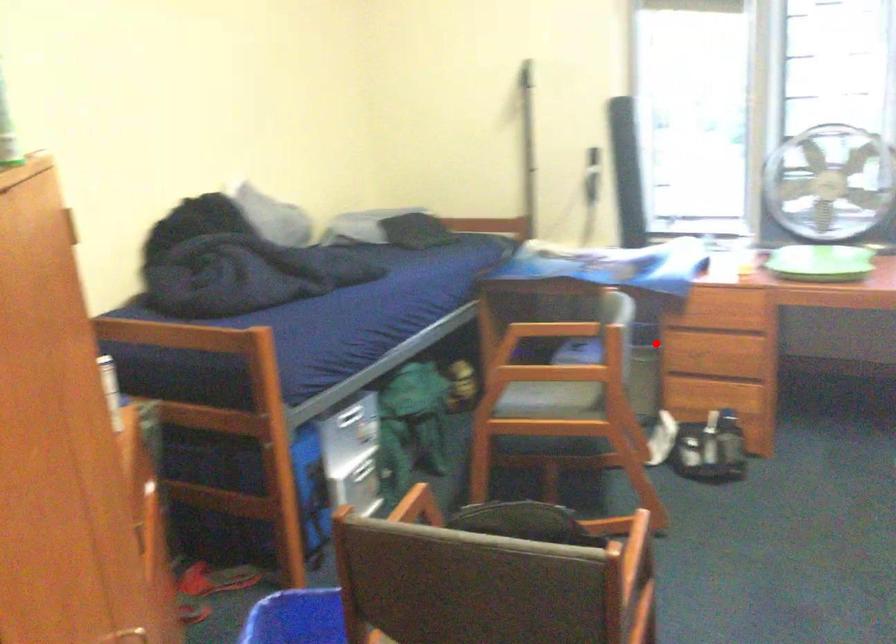
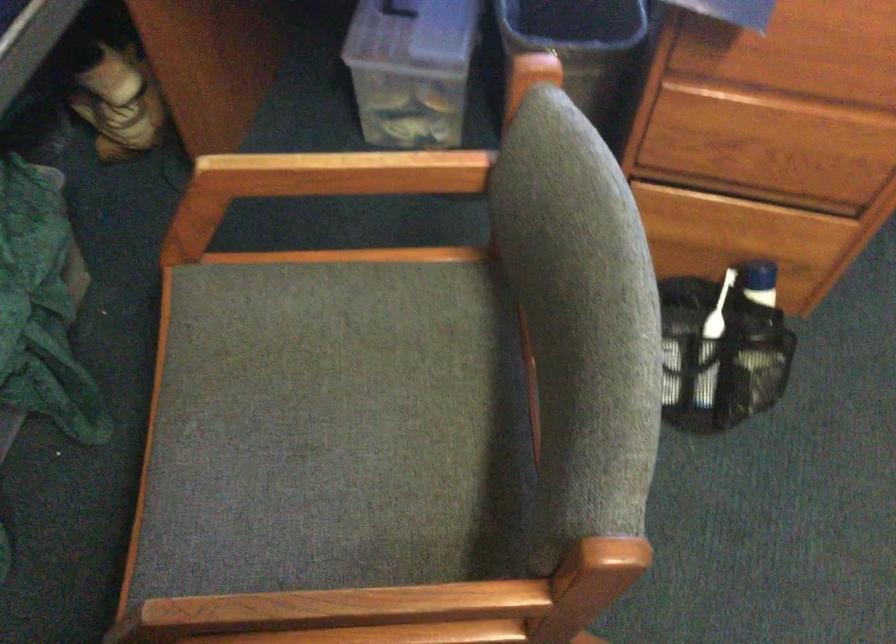
Locate, in the second image, the point that corresponds to the highlighted location in the first image.

(583, 49)